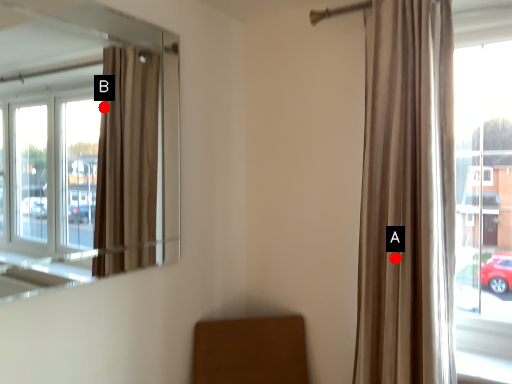
Question: Two points are circled on the image, labeled by A and B beside each circle. Which point is closer to the camera taking this photo?

Choices:
 (A) A is closer
 (B) B is closer

Answer: (A)